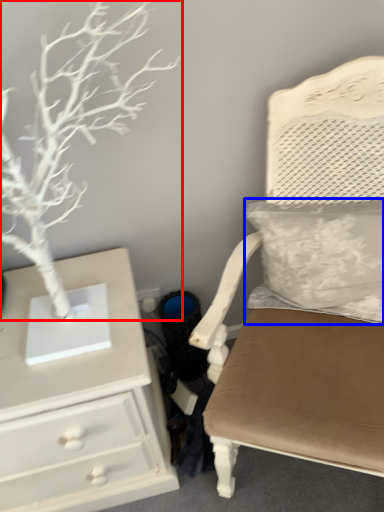
Question: Which of the following is the farthest to the observer, tree (highlighted by a red box) or pillow (highlighted by a blue box)?

Choices:
 (A) tree
 (B) pillow

Answer: (B)